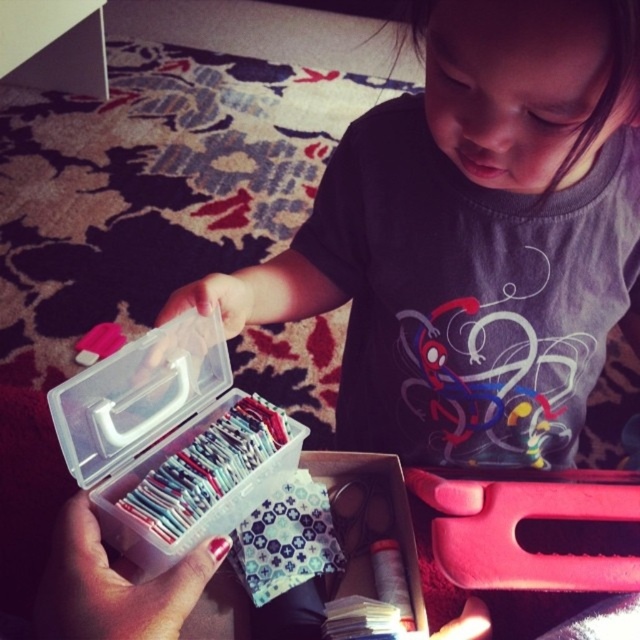
Who is taller, matte plastic girl at center or transparent plastic box at center?

matte plastic girl at center is taller.

Does point (413, 330) come farther from viewer compared to point (109, 401)?

That is True.

Measure the distance between point (385, 273) and camera.

They are 59.42 centimeters apart.

Identify the location of matte plastic girl at center. (474, 236).